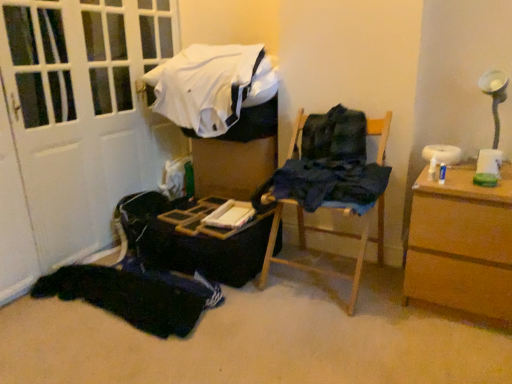
Question: Is point (303, 236) positioned closer to the camera than point (192, 319)?

Choices:
 (A) farther
 (B) closer

Answer: (A)

Question: Is wooden chair at center situated inside black fabric at lower left, which appears as the 3th clothing when viewed from the top, or outside?

Choices:
 (A) inside
 (B) outside

Answer: (B)

Question: Estimate the real-world distances between objects in this image. Which object is farther from the white matte door at left?

Choices:
 (A) white cotton shirt at upper center, acting as the 3th clothing starting from the bottom
 (B) black fabric at lower left, which appears as the 3th clothing when viewed from the top
 (C) brown wooden chest of drawers at right
 (D) dark blue fabric at center, the second clothing from the top
 (E) wooden chair at center

Answer: (C)

Question: Which object is the farthest from the brown wooden chest of drawers at right?

Choices:
 (A) black fabric at lower left, placed as the 1th clothing when sorted from bottom to top
 (B) white matte door at left
 (C) white cotton shirt at upper center, the 1th clothing from the top
 (D) wooden chair at center
 (E) dark blue fabric at center, the second clothing from the top

Answer: (B)